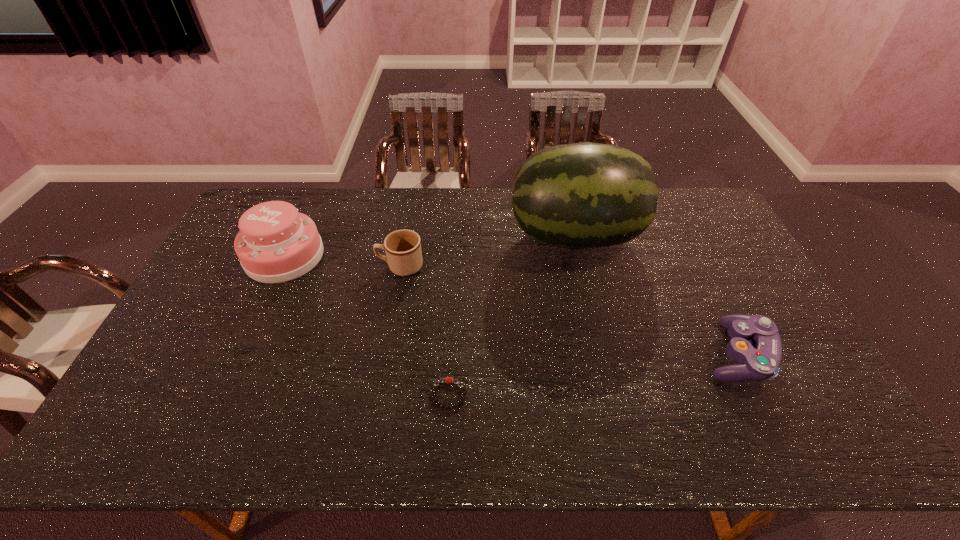
Where is `vacant space located 0.050m on the side of the mug with the handle`? vacant space located 0.050m on the side of the mug with the handle is located at coordinates (362, 266).

You are a GUI agent. You are given a task and a screenshot of the screen. Output one action in this format:
    pyautogui.click(x=<x>, y=<y>)
    Task: Click on the free location located 0.250m on the side of the mug with the handle
    
    Given the screenshot: What is the action you would take?
    pyautogui.click(x=300, y=266)

The image size is (960, 540). Identify the location of vacant area situated on the side of the mug with the handle. (258, 266).

You are a GUI agent. You are given a task and a screenshot of the screen. Output one action in this format:
    pyautogui.click(x=<x>, y=<y>)
    Task: Click on the free space located 0.070m on the left of the rightmost object
    
    Given the screenshot: What is the action you would take?
    [675, 354]

This screenshot has height=540, width=960. Identify the location of vacant space located 0.390m on the right of the bracelet. (623, 394).

This screenshot has width=960, height=540. Find the location of `object at the far edge`. object at the far edge is located at coordinates (582, 195).

Where is `object that is at the left edge`? The image size is (960, 540). object that is at the left edge is located at coordinates (275, 244).

This screenshot has height=540, width=960. I want to click on object located at the right edge, so click(759, 360).

Where is `free space at the far edge of the desktop`? free space at the far edge of the desktop is located at coordinates (436, 204).

The image size is (960, 540). In order to click on free location at the near edge of the desktop in this screenshot , I will do `click(362, 441)`.